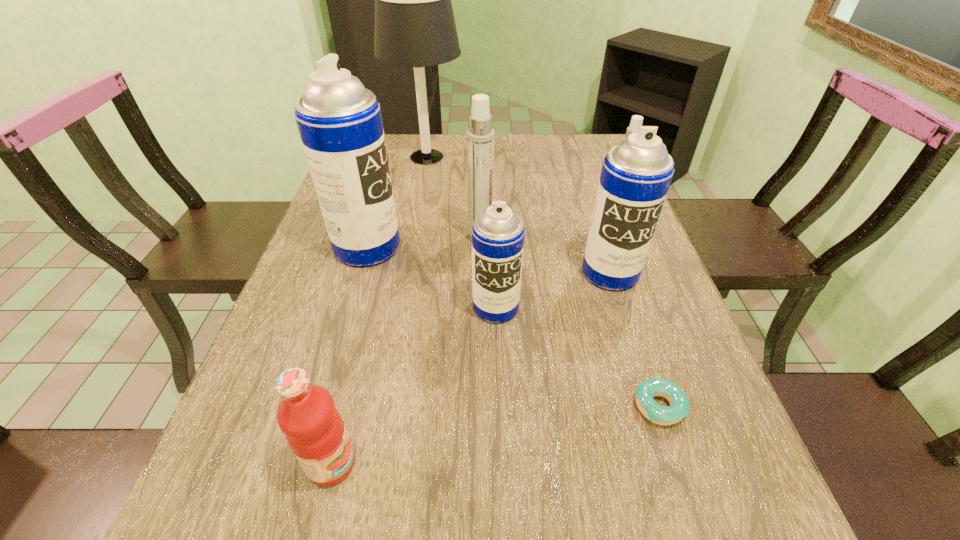
This screenshot has width=960, height=540. What are the coordinates of `the nearest object` in the screenshot? It's located at (315, 431).

Find the location of a particular element. The width and height of the screenshot is (960, 540). the shortest object is located at coordinates (679, 408).

Locate an element on the screen. the second nearest object is located at coordinates (679, 408).

Where is `free space located on the right of the table lamp`? The image size is (960, 540). free space located on the right of the table lamp is located at coordinates (x=571, y=157).

The height and width of the screenshot is (540, 960). I want to click on vacant area situated on the label side of the leftmost aerosol can, so click(465, 247).

This screenshot has width=960, height=540. Find the location of `vacant space located on the front of the left white aerosol can`. vacant space located on the front of the left white aerosol can is located at coordinates (481, 312).

At what (x,y) coordinates should I click in order to perform the action: click on free spot located on the label side of the rightmost blue aerosol can. Please return your answer as a coordinate pair (x, y). The image size is (960, 540). Looking at the image, I should click on (629, 330).

Locate an element on the screen. The width and height of the screenshot is (960, 540). vacant space located on the back of the farthest aerosol can is located at coordinates (607, 192).

Locate an element on the screen. Image resolution: width=960 pixels, height=540 pixels. free region located 0.340m on the label side of the second blue aerosol can from left to right is located at coordinates [x=502, y=495].

The height and width of the screenshot is (540, 960). I want to click on vacant point located on the front label of the second shortest object, so coord(400,464).